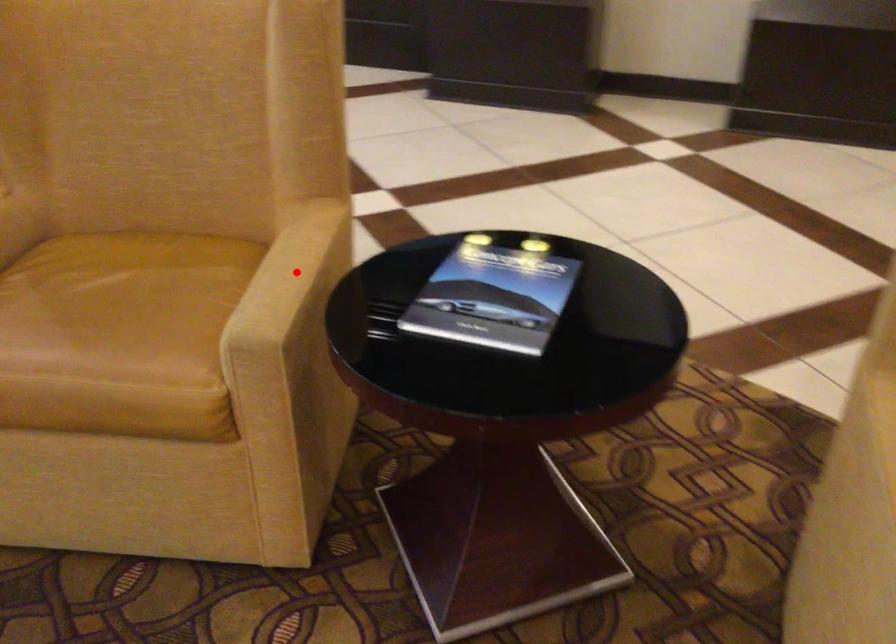
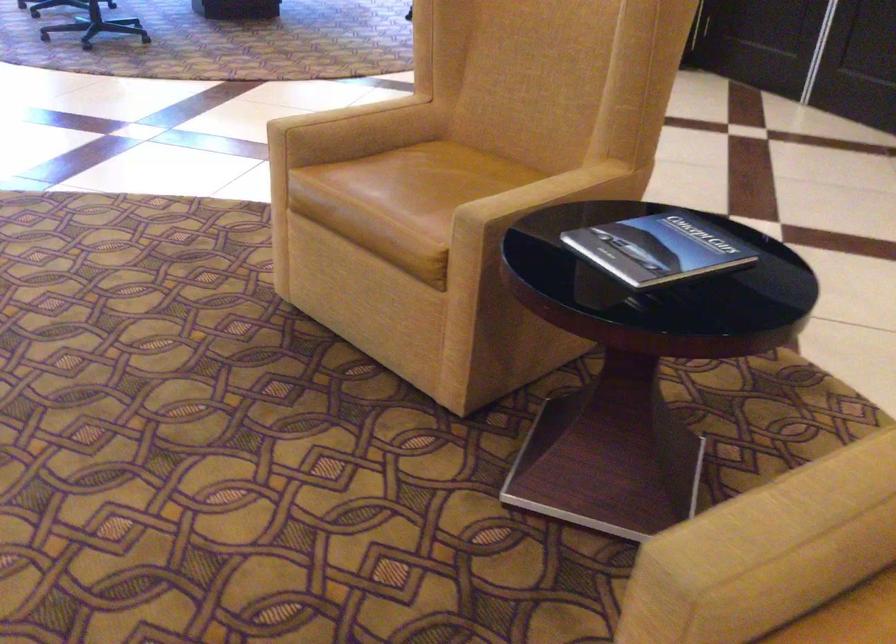
Question: I am providing you with two images of the same scene from different viewpoints. In image1, a red point is highlighted. Considering the same 3D point in image2, which of the following is correct?

Choices:
 (A) It is closer
 (B) It is farther

Answer: (B)